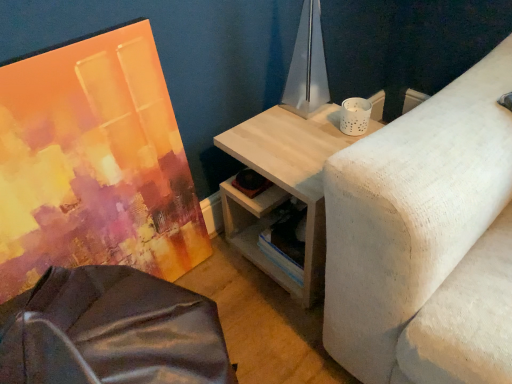
Question: Does matte acrylic painting at left have a lesser height compared to metallic silver table lamp at upper center?

Choices:
 (A) yes
 (B) no

Answer: (B)

Question: Is matte acrylic painting at left aimed at metallic silver table lamp at upper center?

Choices:
 (A) no
 (B) yes

Answer: (A)

Question: From the image's perspective, is matte acrylic painting at left on metallic silver table lamp at upper center?

Choices:
 (A) yes
 (B) no

Answer: (B)

Question: From the image's perspective, would you say matte acrylic painting at left is shown under metallic silver table lamp at upper center?

Choices:
 (A) no
 (B) yes

Answer: (B)

Question: Is matte acrylic painting at left further to the viewer compared to metallic silver table lamp at upper center?

Choices:
 (A) no
 (B) yes

Answer: (A)

Question: Is matte acrylic painting at left next to metallic silver table lamp at upper center?

Choices:
 (A) no
 (B) yes

Answer: (A)

Question: Can you confirm if metallic silver table lamp at upper center is positioned to the left of matte acrylic painting at left?

Choices:
 (A) yes
 (B) no

Answer: (B)

Question: From a real-world perspective, is metallic silver table lamp at upper center located beneath matte acrylic painting at left?

Choices:
 (A) no
 (B) yes

Answer: (A)

Question: Can you confirm if metallic silver table lamp at upper center is shorter than matte acrylic painting at left?

Choices:
 (A) yes
 (B) no

Answer: (A)

Question: Can you confirm if metallic silver table lamp at upper center is taller than matte acrylic painting at left?

Choices:
 (A) no
 (B) yes

Answer: (A)

Question: Is the position of metallic silver table lamp at upper center less distant than that of matte acrylic painting at left?

Choices:
 (A) no
 (B) yes

Answer: (A)

Question: Is metallic silver table lamp at upper center outside of matte acrylic painting at left?

Choices:
 (A) no
 (B) yes

Answer: (B)

Question: From a real-world perspective, is matte acrylic painting at left on top of light wood/texture side table at upper right?

Choices:
 (A) no
 (B) yes

Answer: (B)